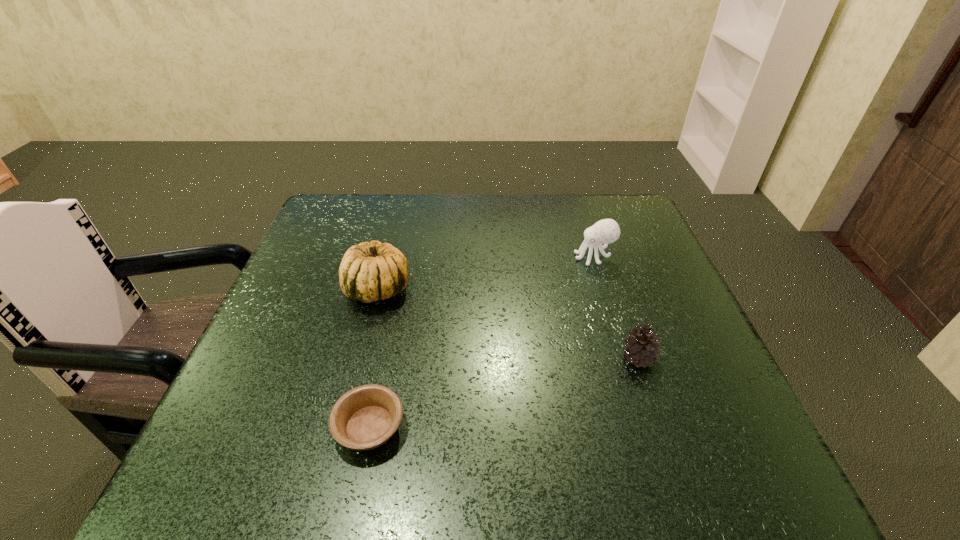
Locate an element on the screen. The width and height of the screenshot is (960, 540). vacant area at the far right corner of the desktop is located at coordinates (638, 210).

Image resolution: width=960 pixels, height=540 pixels. I want to click on vacant space at the near right corner, so coord(700,447).

Image resolution: width=960 pixels, height=540 pixels. In order to click on unoccupied area between the gourd and the octopus in this screenshot , I will do `click(486, 273)`.

Image resolution: width=960 pixels, height=540 pixels. Find the location of `free spot between the gourd and the octopus`. free spot between the gourd and the octopus is located at coordinates (486, 273).

The height and width of the screenshot is (540, 960). Find the location of `vacant area that lies between the nearest object and the pinecone`. vacant area that lies between the nearest object and the pinecone is located at coordinates (504, 392).

Find the location of a particular element. free spot between the third farthest object and the octopus is located at coordinates (616, 307).

Locate an element on the screen. The image size is (960, 540). empty space between the third farthest object and the shortest object is located at coordinates (504, 392).

This screenshot has height=540, width=960. I want to click on empty space between the farthest object and the bowl, so click(482, 342).

Where is `free point between the farthest object and the third nearest object`? This screenshot has height=540, width=960. free point between the farthest object and the third nearest object is located at coordinates (486, 273).

Where is `vacant point located between the pinecone and the nearest object`? vacant point located between the pinecone and the nearest object is located at coordinates (504, 392).